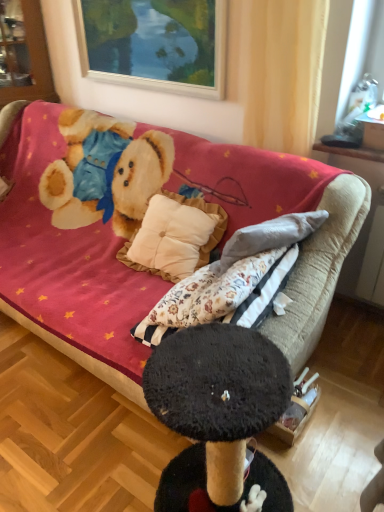
Question: Should I look upward or downward to see wooden picture frame at upper center?

Choices:
 (A) up
 (B) down

Answer: (A)

Question: Is wooden picture frame at upper center positioned before brushed metal cabinet at upper left?

Choices:
 (A) yes
 (B) no

Answer: (A)

Question: From the image's perspective, would you say wooden picture frame at upper center is shown under brushed metal cabinet at upper left?

Choices:
 (A) no
 (B) yes

Answer: (B)

Question: Is wooden picture frame at upper center far away from brushed metal cabinet at upper left?

Choices:
 (A) yes
 (B) no

Answer: (B)

Question: Can you confirm if wooden picture frame at upper center is wider than brushed metal cabinet at upper left?

Choices:
 (A) yes
 (B) no

Answer: (B)

Question: From a real-world perspective, is wooden picture frame at upper center over brushed metal cabinet at upper left?

Choices:
 (A) no
 (B) yes

Answer: (B)

Question: Is wooden picture frame at upper center outside of brushed metal cabinet at upper left?

Choices:
 (A) no
 (B) yes

Answer: (B)

Question: From a real-world perspective, is yellow sheer curtain at upper center on brushed metal cabinet at upper left?

Choices:
 (A) no
 (B) yes

Answer: (B)

Question: Is yellow sheer curtain at upper center oriented away from brushed metal cabinet at upper left?

Choices:
 (A) yes
 (B) no

Answer: (B)

Question: Is yellow sheer curtain at upper center not near brushed metal cabinet at upper left?

Choices:
 (A) yes
 (B) no

Answer: (A)

Question: Considering the relative sizes of yellow sheer curtain at upper center and brushed metal cabinet at upper left in the image provided, is yellow sheer curtain at upper center smaller than brushed metal cabinet at upper left?

Choices:
 (A) yes
 (B) no

Answer: (A)

Question: Is yellow sheer curtain at upper center not within brushed metal cabinet at upper left?

Choices:
 (A) no
 (B) yes

Answer: (B)

Question: Does yellow sheer curtain at upper center come in front of brushed metal cabinet at upper left?

Choices:
 (A) no
 (B) yes

Answer: (B)

Question: Is brushed metal cabinet at upper left touching yellow sheer curtain at upper center?

Choices:
 (A) yes
 (B) no

Answer: (B)